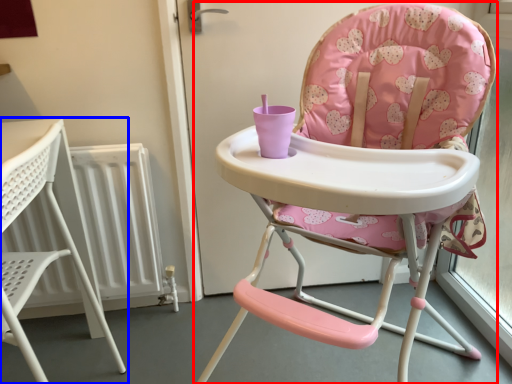
Question: Which of the following is the closest to the observer, chair (highlighted by a red box) or chair (highlighted by a blue box)?

Choices:
 (A) chair
 (B) chair

Answer: (A)